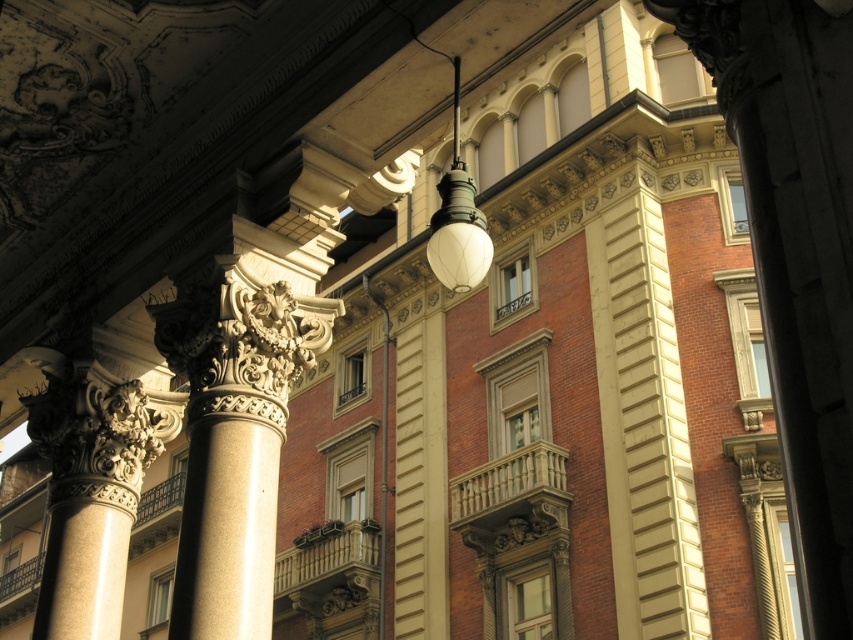
You are standing in front of the ornate building and notice two points marked on the facade. The first point is at coordinates point (433,243) and the second at point (183,481). From your perspective, which point appears closer to you?

Point (433,243) is in front of point (183,481), so it appears closer to you.

You are an architect examining the building facade. You need to locate the white marble balustrade at center and the dark brown wrought iron at lower left. Which object is positioned to the right of the other?

The white marble balustrade at center is to the right of dark brown wrought iron at lower left.